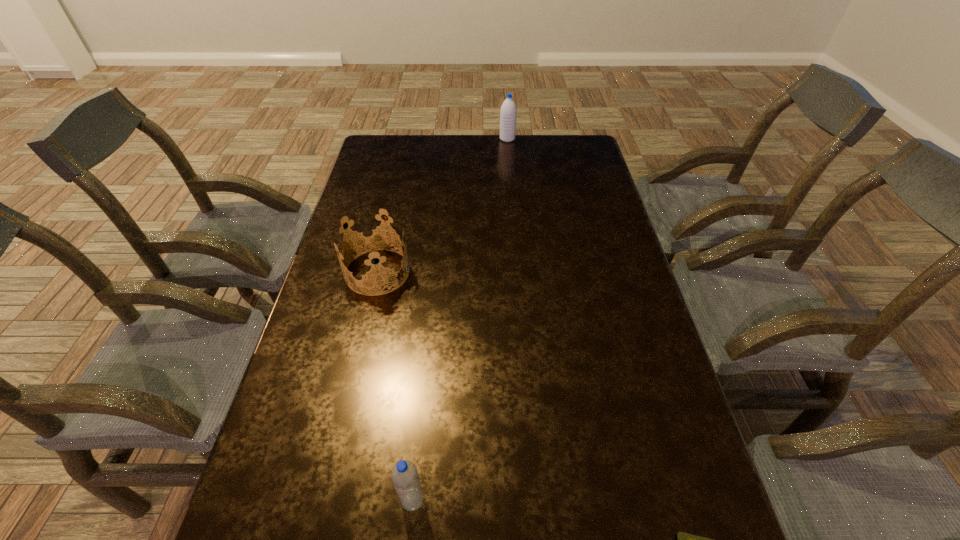
Identify the location of the right water bottle. The image size is (960, 540). (508, 114).

Locate an element on the screen. The width and height of the screenshot is (960, 540). the second object from right to left is located at coordinates (508, 114).

This screenshot has height=540, width=960. Identify the location of the nearer water bottle. (404, 475).

Find the location of a particular element. This screenshot has width=960, height=540. the left water bottle is located at coordinates [404, 475].

Find the location of `the leftmost object`. the leftmost object is located at coordinates (376, 273).

Identify the location of the second farthest object. Image resolution: width=960 pixels, height=540 pixels. (376, 273).

At what (x,y) coordinates should I click in order to perform the action: click on free space located 0.330m on the front of the farther water bottle. Please return your answer as a coordinate pair (x, y). The width and height of the screenshot is (960, 540). Looking at the image, I should click on (512, 191).

Where is `free region located 0.270m on the right of the left water bottle`? The image size is (960, 540). free region located 0.270m on the right of the left water bottle is located at coordinates (566, 500).

Where is `free region located on the right of the third nearest object`? This screenshot has width=960, height=540. free region located on the right of the third nearest object is located at coordinates (476, 272).

The width and height of the screenshot is (960, 540). Find the location of `object that is at the far edge`. object that is at the far edge is located at coordinates (508, 114).